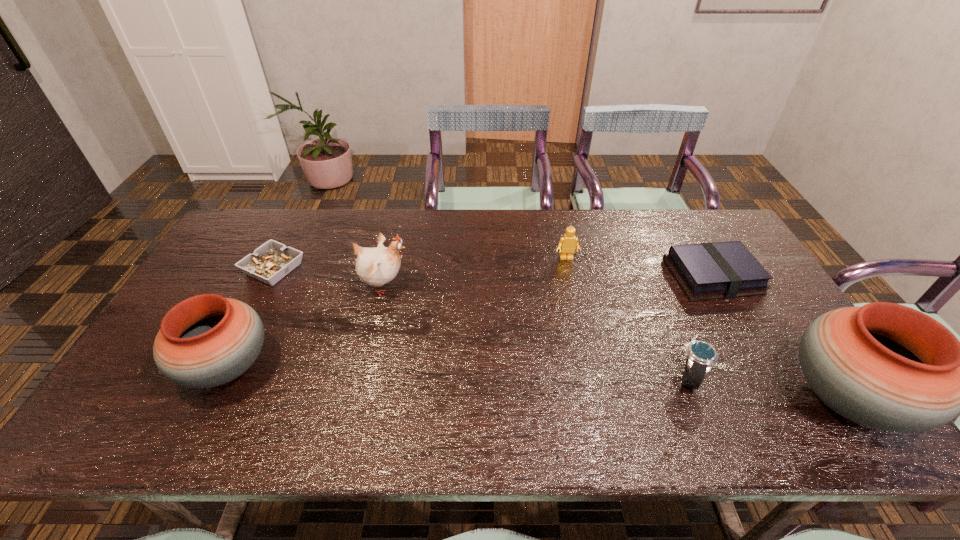
To ensure equal spacing by inserting another pottery among them, please point out a vacant spot for this new pottery. Please provide its 2D coordinates. Your answer should be formatted as a tuple, i.e. [(x, y)], where the tuple contains the x and y coordinates of a point satisfying the conditions above.

[(527, 382)]